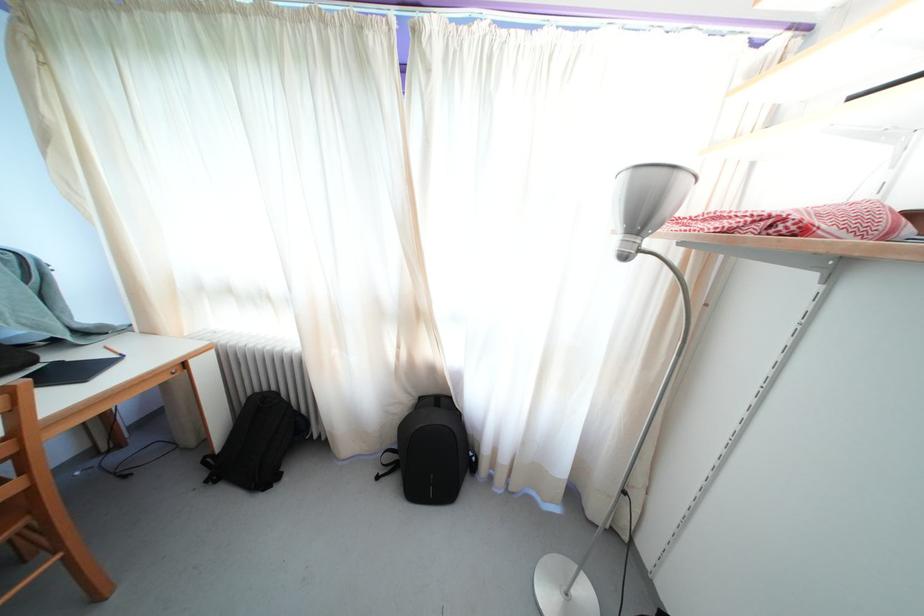
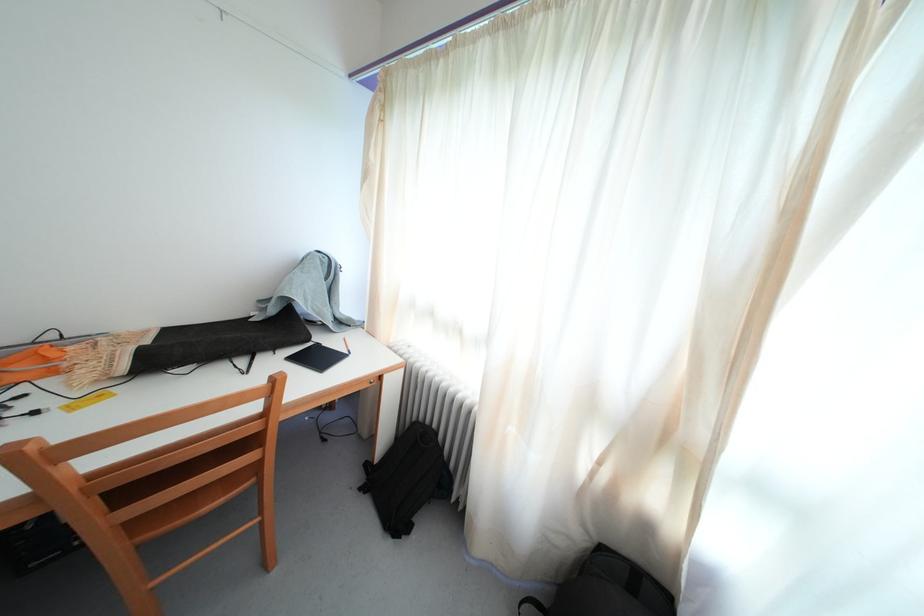
Question: The camera is either moving clockwise (left) or counter-clockwise (right) around the object. The first image is from the beginning of the video and the second image is from the end. Is the camera moving left or right when shooting the video?

Choices:
 (A) Left
 (B) Right

Answer: (B)